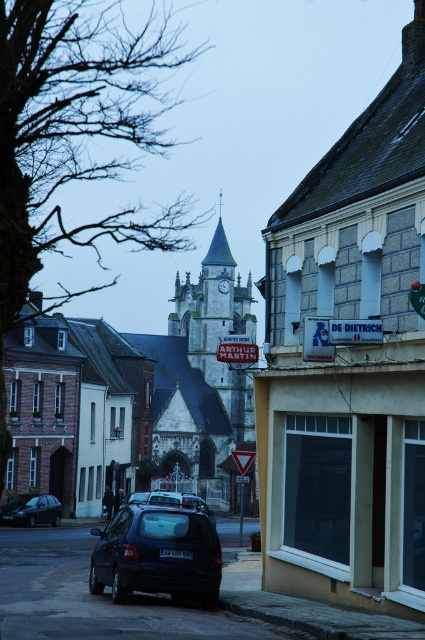
You are a tourist standing on the European street and want to take a photo of both the white stone church at center and the metallic gray clock at center. Which object should you focus on first if you want to capture both in the same frame without moving your camera?

The white stone church at center is taller than the metallic gray clock at center. To capture both in the same frame without moving the camera, focus on the metallic gray clock at center first since it is shorter and adjust the framing to include the taller church.

You are a tourist standing in the middle of the European street. You see the white stone church at center and the metallic gray clock at center. Which object is wider?

The white stone church at center is wider than the metallic gray clock at center.

You are a tourist standing at the entrance of the street. You want to visit the white stone church at center and then check the time at the metallic gray clock at center. Given that your average walking speed is 3 feet per second, how many seconds will it take you to walk from the church to the clock?

The distance between the white stone church at center and the metallic gray clock at center is 97.92 feet. At a walking speed of 3 feet per second, it would take 97.92 divided by 3 equals 32.64 seconds. So approximately 33 seconds.